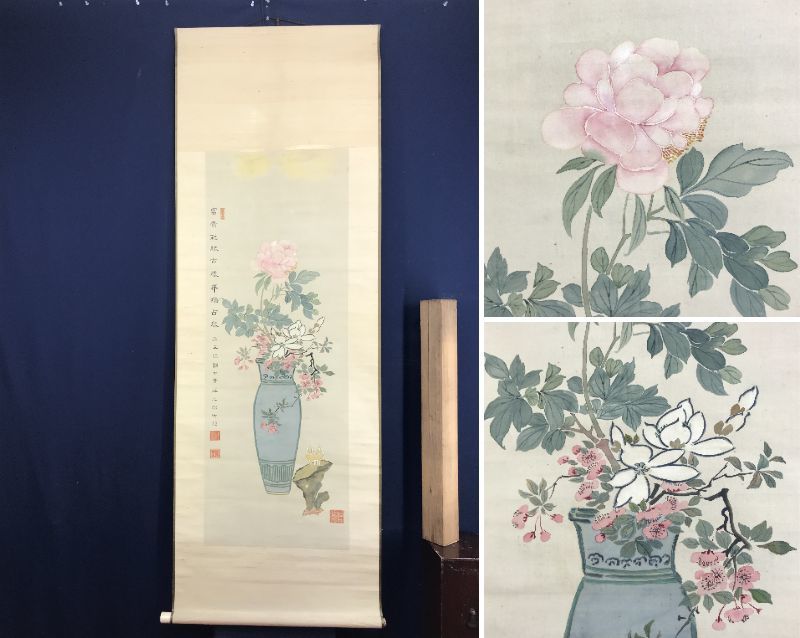
You are a GUI agent. You are given a task and a screenshot of the screen. Output one action in this format:
    pyautogui.click(x=<x>, y=<y>)
    Task: Click on the pot
    The width and height of the screenshot is (800, 638).
    Given the screenshot: What is the action you would take?
    pyautogui.click(x=596, y=568)